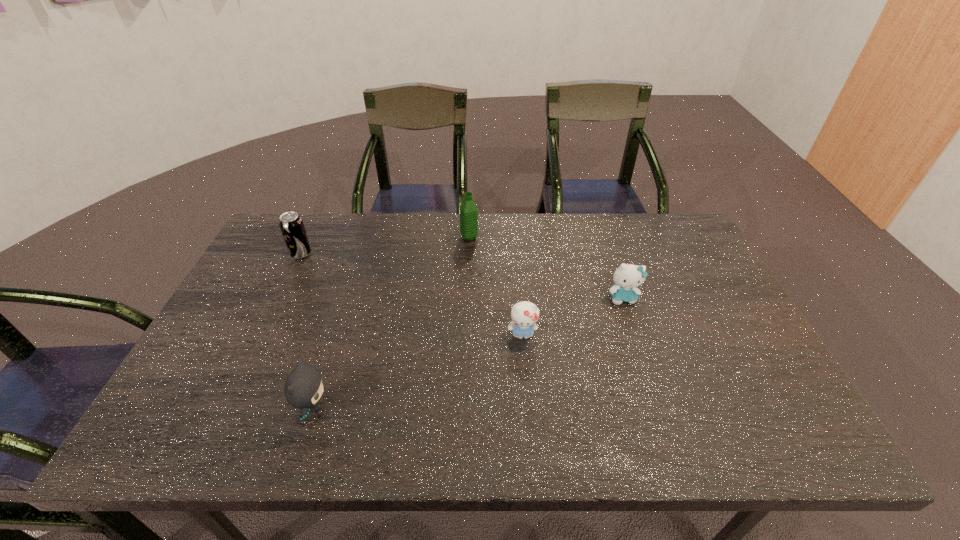
In the image, there is a desktop. Where is `free space at the far edge`? This screenshot has width=960, height=540. free space at the far edge is located at coordinates (473, 242).

Where is `vacant space at the near edge`? The image size is (960, 540). vacant space at the near edge is located at coordinates (312, 430).

Find the location of a particular element. vacant space at the left edge is located at coordinates [253, 361].

In the image, there is a desktop. Identify the location of vacant space at the right edge. (736, 374).

In the image, there is a desktop. What are the coordinates of `vacant space at the far left corner` in the screenshot? It's located at (314, 231).

At what (x,y) coordinates should I click in order to perform the action: click on vacant region at the near right corner of the desktop. Please return your answer as a coordinate pair (x, y). Looking at the image, I should click on (771, 442).

Locate an element on the screen. The image size is (960, 540). empty location between the farthest object and the fourth object from right to left is located at coordinates (392, 323).

Find the location of a particular element. vacant area between the third nearest object and the soda can is located at coordinates (462, 276).

What are the coordinates of `free space between the leftmost object and the nearest kitten` in the screenshot? It's located at (308, 332).

Identify the location of free space between the third object from right to left and the soda can. Image resolution: width=960 pixels, height=540 pixels. (385, 246).